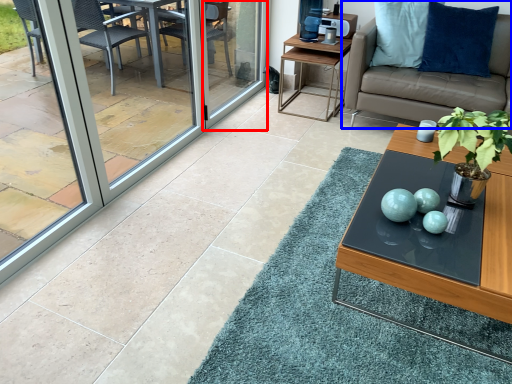
Question: Which object is closer to the camera taking this photo, screen door (highlighted by a red box) or studio couch (highlighted by a blue box)?

Choices:
 (A) screen door
 (B) studio couch

Answer: (B)